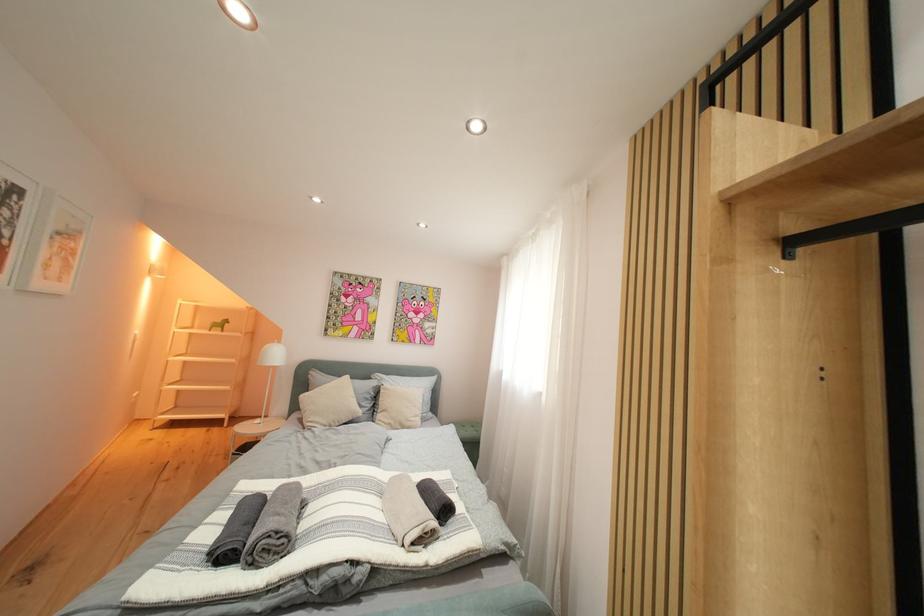
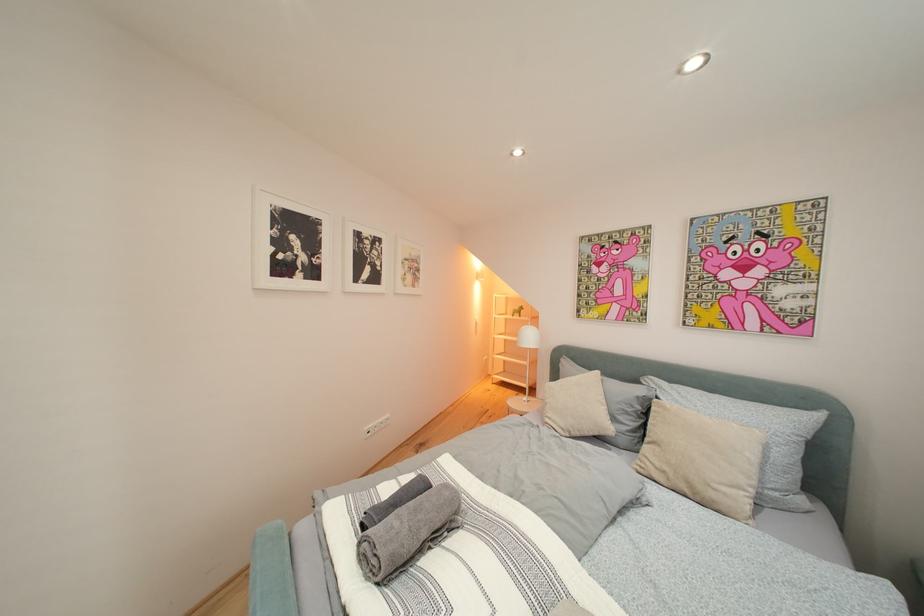
Question: How did the camera likely rotate?

Choices:
 (A) Left
 (B) Right
 (C) Up
 (D) Down

Answer: (A)